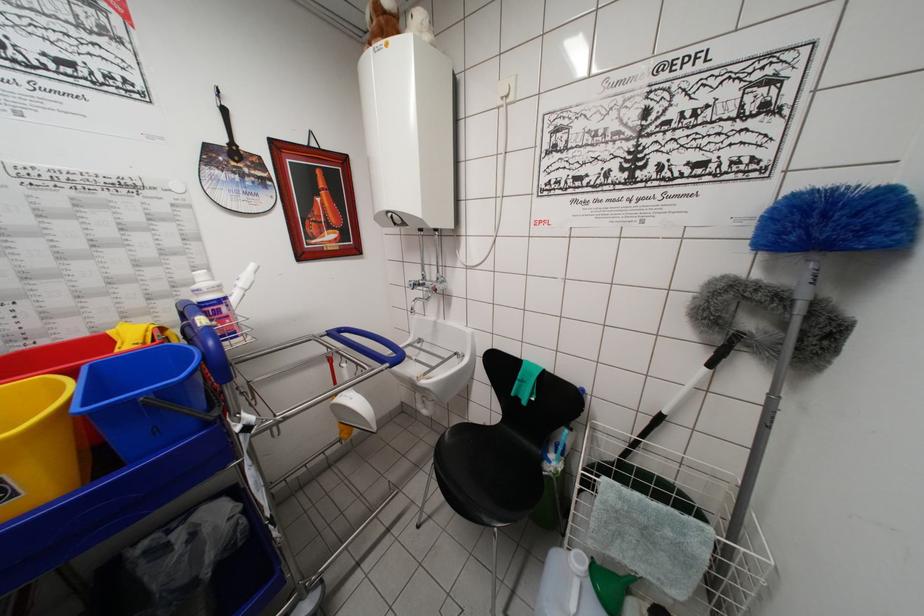
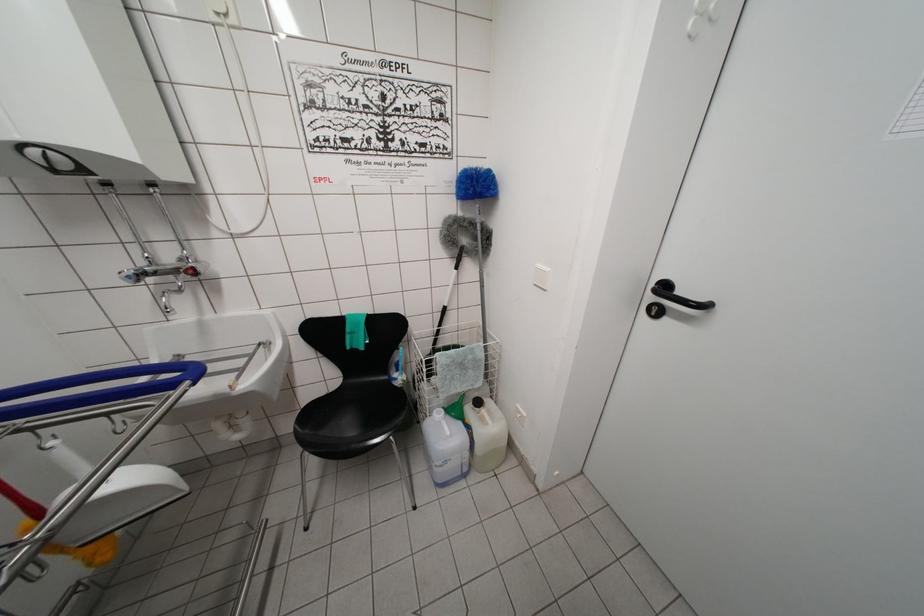
Find the pixel in the second image that matches (414,290) in the first image.

(131, 282)